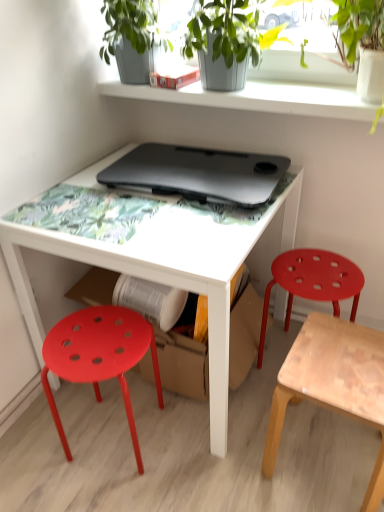
Question: Looking at their shapes, would you say matte plastic stool at right, which is the 3th stool from left to right, is wider or thinner than black matte laptop at center?

Choices:
 (A) wide
 (B) thin

Answer: (B)

Question: Is matte plastic stool at right, the 1th stool positioned from the right, inside the boundaries of black matte laptop at center, or outside?

Choices:
 (A) inside
 (B) outside

Answer: (B)

Question: Which object is positioned closest to the white glossy table at center?

Choices:
 (A) green matte plant at upper center
 (B) light brown wooden stool at lower right, which appears as the second stool when viewed from the right
 (C) smooth gray concrete shelf at upper center
 (D) matte plastic stool at lower left, the 1th stool from the left
 (E) matte plastic stool at right, the 1th stool positioned from the right

Answer: (D)

Question: Which object is the farthest from the matte plastic stool at right, which is the 3th stool from left to right?

Choices:
 (A) black matte laptop at center
 (B) light brown wooden stool at lower right, marked as the 2th stool in a left-to-right arrangement
 (C) smooth gray concrete shelf at upper center
 (D) matte plastic stool at lower left, the 1th stool from the left
 (E) white glossy table at center

Answer: (D)